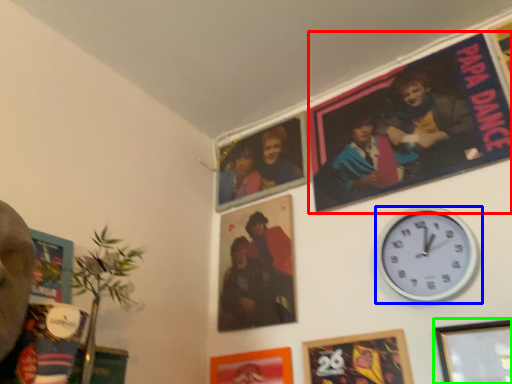
Question: Which object is the farthest from movie poster (highlighted by a red box)? Choose among these: wall clock (highlighted by a blue box) or picture frame (highlighted by a green box).

Choices:
 (A) wall clock
 (B) picture frame

Answer: (B)